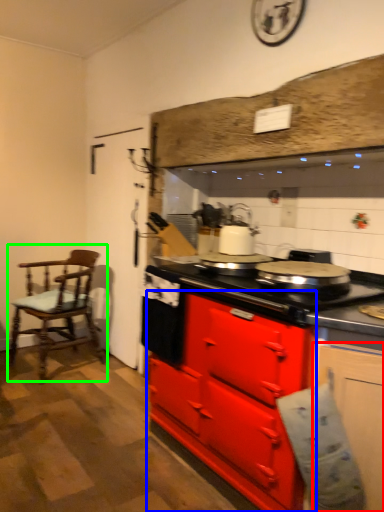
Question: Based on their relative distances, which object is nearer to cabinetry (highlighted by a red box)? Choose from cabinetry (highlighted by a blue box) and chair (highlighted by a green box).

Choices:
 (A) cabinetry
 (B) chair

Answer: (A)